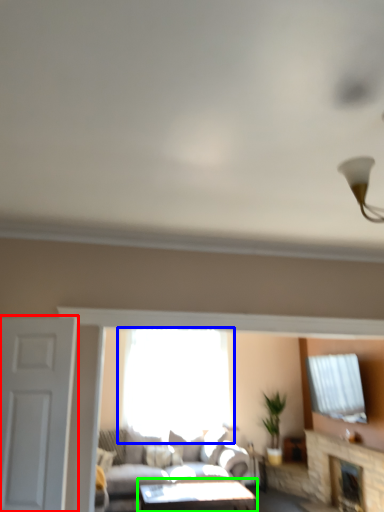
Question: Considering the real-world distances, which object is farthest from door (highlighted by a red box)? window (highlighted by a blue box) or table (highlighted by a green box)?

Choices:
 (A) window
 (B) table

Answer: (A)